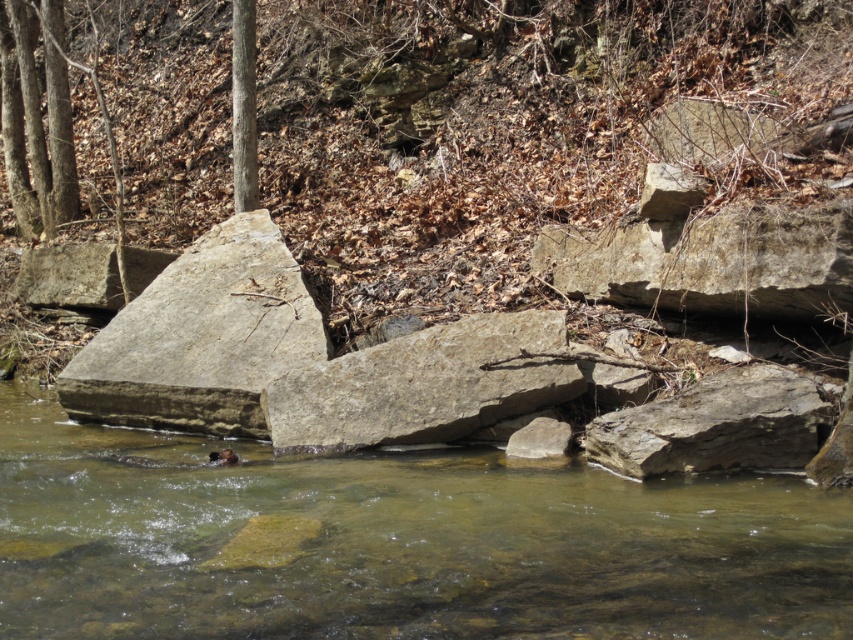
Question: Among these objects, which one is farthest from the camera?

Choices:
 (A) brown rocky hillside at upper center
 (B) clear water at center
 (C) gray rough rock at lower right

Answer: (A)

Question: Is brown rocky hillside at upper center positioned before clear water at center?

Choices:
 (A) no
 (B) yes

Answer: (A)

Question: Based on their relative distances, which object is nearer to the clear water at center?

Choices:
 (A) brown rocky hillside at upper center
 (B) gray rough rock at lower right

Answer: (B)

Question: Is gray rough stone at center to the right of gray rough rock at lower right from the viewer's perspective?

Choices:
 (A) no
 (B) yes

Answer: (A)

Question: Among these objects, which one is nearest to the camera?

Choices:
 (A) gray rough stone at center
 (B) clear water at center
 (C) gray rough rock at lower right

Answer: (B)

Question: Is brown rocky hillside at upper center wider than clear water at center?

Choices:
 (A) yes
 (B) no

Answer: (A)